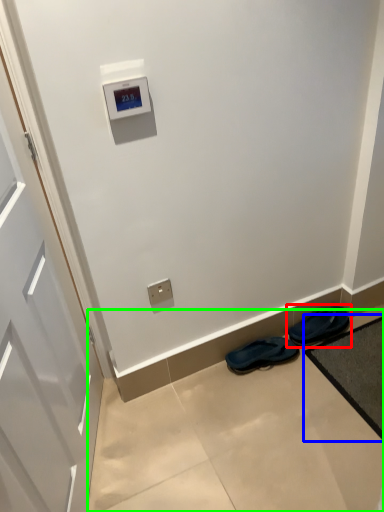
Question: Estimate the real-world distances between objects in this image. Which object is closer to footwear (highlighted by a red box), bath mat (highlighted by a blue box) or concrete (highlighted by a green box)?

Choices:
 (A) bath mat
 (B) concrete

Answer: (A)